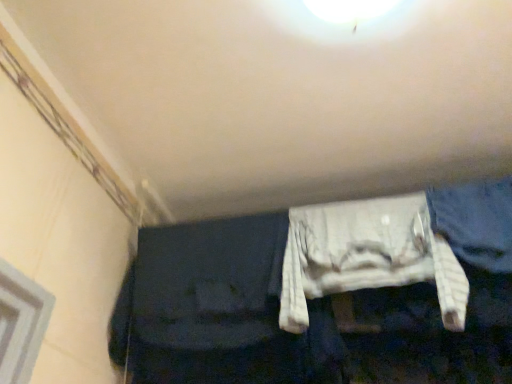
Question: From a real-world perspective, is white fabric cushion at center positioned above or below denim at right?

Choices:
 (A) below
 (B) above

Answer: (A)

Question: Is white fabric cushion at center in front of or behind denim at right in the image?

Choices:
 (A) front
 (B) behind

Answer: (A)

Question: Do you think white fabric cushion at center is within denim at right, or outside of it?

Choices:
 (A) outside
 (B) inside

Answer: (A)

Question: Based on their sizes in the image, would you say denim at right is bigger or smaller than white fabric cushion at center?

Choices:
 (A) big
 (B) small

Answer: (B)

Question: Considering their positions, is denim at right located in front of or behind white fabric cushion at center?

Choices:
 (A) front
 (B) behind

Answer: (B)

Question: In the image, is denim at right on the left side or the right side of white fabric cushion at center?

Choices:
 (A) left
 (B) right

Answer: (B)

Question: From the image's perspective, relative to white fabric cushion at center, is denim at right above or below?

Choices:
 (A) above
 (B) below

Answer: (A)